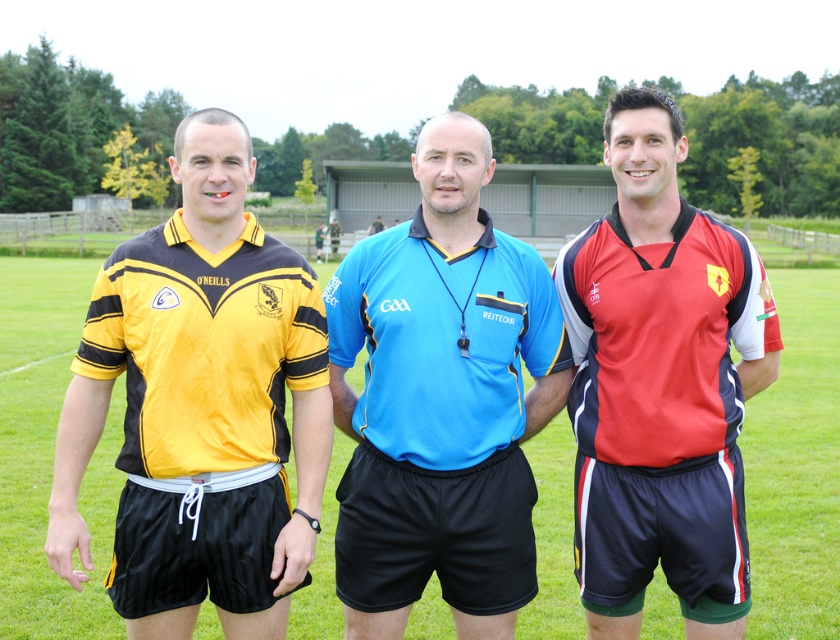
Question: Does blue jersey at center have a greater width compared to red matte jersey at right?

Choices:
 (A) yes
 (B) no

Answer: (A)

Question: Is yellow matte jersey at left smaller than blue jersey at center?

Choices:
 (A) no
 (B) yes

Answer: (A)

Question: Among these points, which one is farthest from the camera?

Choices:
 (A) 581,310
 (B) 379,346
 (C) 46,451

Answer: (C)

Question: Estimate the real-world distances between objects in this image. Which object is closer to the blue jersey at center?

Choices:
 (A) green grass football field at center
 (B) red matte jersey at right
 (C) yellow matte jersey at left

Answer: (B)

Question: Is red matte jersey at right further to the viewer compared to green grass football field at center?

Choices:
 (A) no
 (B) yes

Answer: (A)

Question: Which of the following is the closest to the observer?

Choices:
 (A) coord(169,320)
 (B) coord(339,500)

Answer: (A)